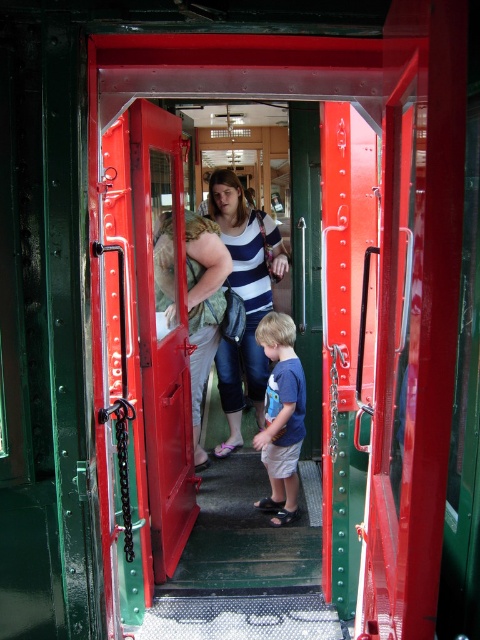
You are a passenger on the train and want to exit through the metallic red door at center. There is a person wearing a striped fabric shirt at center blocking the door. Can you exit without moving the person?

The metallic red door at center is in front of the striped fabric shirt at center, so the door is not blocked. You can exit without moving the person.

You are a passenger on the train and need to know if you can comfortably stand upright between the metallic red door at center and the striped fabric shirt at center without touching either. Can you?

The metallic red door at center is taller than the striped fabric shirt at center, so there should be enough vertical space to stand upright without touching either object.